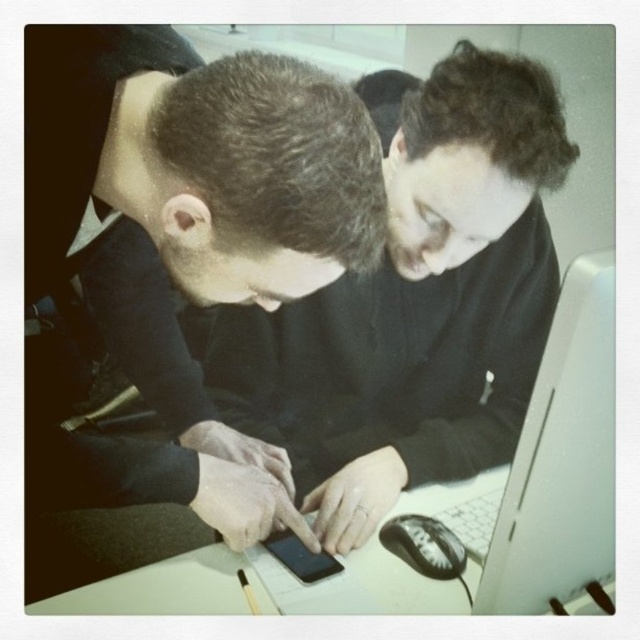
Can you confirm if black plastic mouse at lower center is positioned below white plastic keyboard at lower right?

Yes, black plastic mouse at lower center is below white plastic keyboard at lower right.

Where is `black plastic mouse at lower center`? The height and width of the screenshot is (640, 640). black plastic mouse at lower center is located at coordinates (424, 545).

Consider the image. Is white glossy laptop at center smaller than black plastic mouse at lower center?

No, white glossy laptop at center is not smaller than black plastic mouse at lower center.

Is point (579, 564) behind point (394, 547)?

No, it is not.

Describe the element at coordinates (554, 465) in the screenshot. The image size is (640, 640). I see `white glossy laptop at center` at that location.

I want to click on white glossy laptop at center, so pos(554,465).

How distant is white plastic keyboard at lower right from black glossy phone at center?

white plastic keyboard at lower right is 8.07 inches away from black glossy phone at center.

Which is in front, point (492, 518) or point (308, 570)?

Point (308, 570) is more forward.

Locate an element on the screen. white plastic keyboard at lower right is located at coordinates (474, 522).